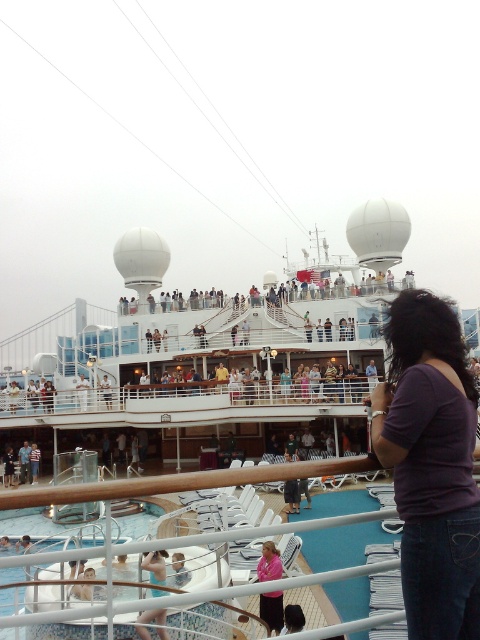
Question: Which object is the closest to the purple matte shirt at lower right?

Choices:
 (A) light blue swimsuit at lower center
 (B) pink fabric shirt at lower center

Answer: (A)

Question: Is purple matte shirt at lower right smaller than pink fabric shirt at lower center?

Choices:
 (A) no
 (B) yes

Answer: (A)

Question: Can you confirm if purple matte shirt at lower right is positioned above pink fabric shirt at lower center?

Choices:
 (A) no
 (B) yes

Answer: (B)

Question: From the image, what is the correct spatial relationship of purple matte shirt at lower right in relation to light blue swimsuit at lower center?

Choices:
 (A) left
 (B) right

Answer: (B)

Question: Which is nearer to the purple matte shirt at lower right?

Choices:
 (A) light blue swimsuit at lower center
 (B) pink fabric shirt at lower center

Answer: (A)

Question: Which point is farther to the camera?

Choices:
 (A) (256, 573)
 (B) (412, 442)

Answer: (A)